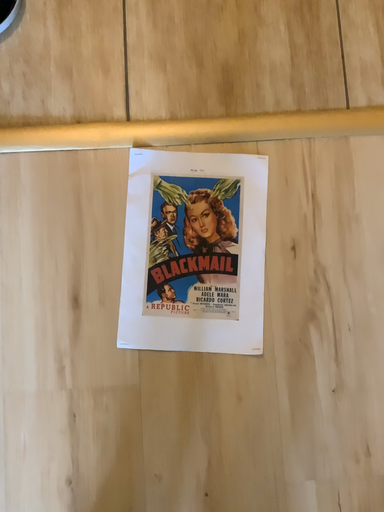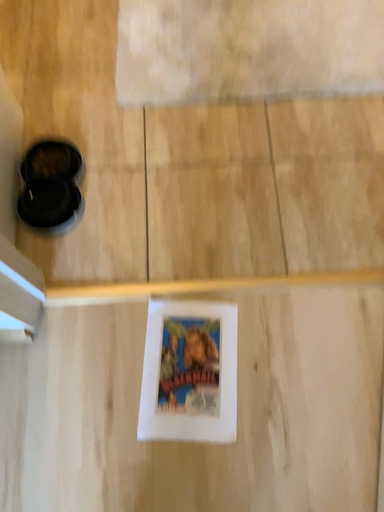
Question: How did the camera likely rotate when shooting the video?

Choices:
 (A) rotated upward
 (B) rotated downward

Answer: (A)